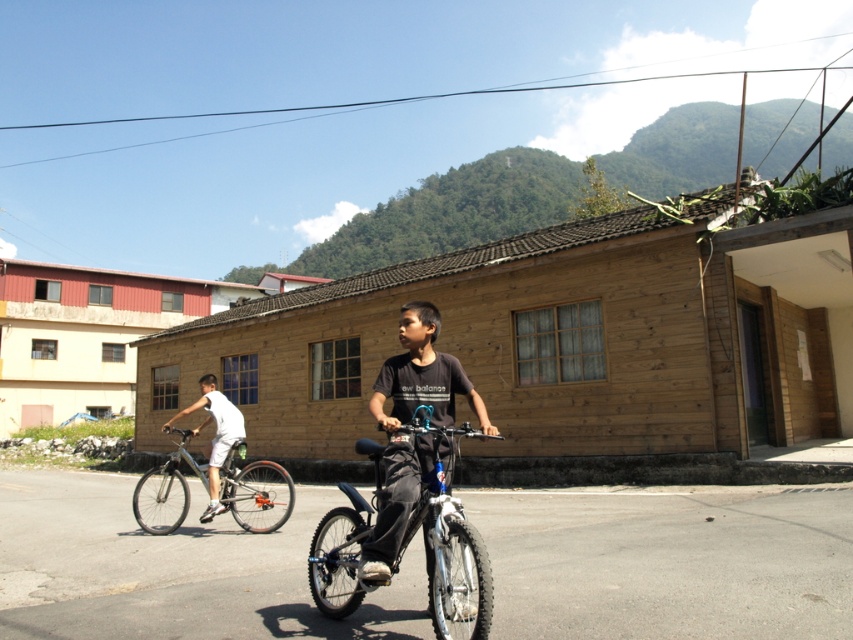
Is shiny blue bicycle at center thinner than silver metallic bicycle at left?

Correct, shiny blue bicycle at center's width is less than silver metallic bicycle at left's.

Can you confirm if shiny blue bicycle at center is smaller than silver metallic bicycle at left?

Indeed, shiny blue bicycle at center has a smaller size compared to silver metallic bicycle at left.

The width and height of the screenshot is (853, 640). What do you see at coordinates (451, 561) in the screenshot?
I see `shiny blue bicycle at center` at bounding box center [451, 561].

The height and width of the screenshot is (640, 853). I want to click on shiny blue bicycle at center, so click(x=451, y=561).

Does silver metallic bicycle at left come behind white matte bicycle at left?

No, it is not.

Who is taller, silver metallic bicycle at left or white matte bicycle at left?

Standing taller between the two is silver metallic bicycle at left.

Where is `silver metallic bicycle at left`? silver metallic bicycle at left is located at coordinates (254, 492).

Does dark gray cotton shirt at center have a greater height compared to silver metallic bicycle at left?

In fact, dark gray cotton shirt at center may be shorter than silver metallic bicycle at left.

Is dark gray cotton shirt at center further to camera compared to silver metallic bicycle at left?

No, dark gray cotton shirt at center is in front of silver metallic bicycle at left.

The width and height of the screenshot is (853, 640). Find the location of `dark gray cotton shirt at center`. dark gray cotton shirt at center is located at coordinates (422, 376).